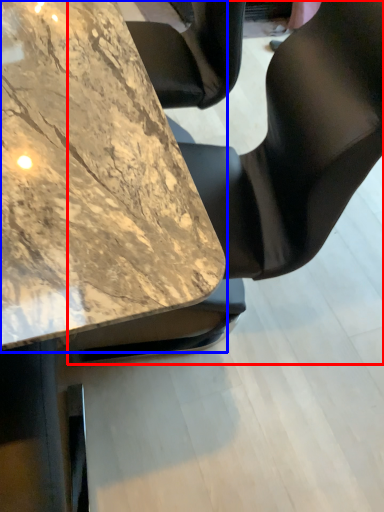
Question: Which object appears closest to the camera in this image, chair (highlighted by a red box) or table (highlighted by a blue box)?

Choices:
 (A) chair
 (B) table

Answer: (B)